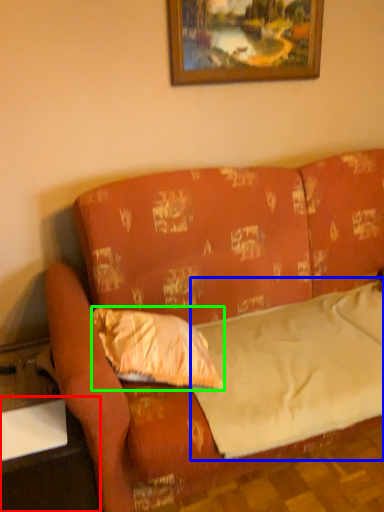
Question: Which is nearer to the table (highlighted by a red box)? sheet (highlighted by a blue box) or pillow (highlighted by a green box).

Choices:
 (A) sheet
 (B) pillow

Answer: (B)